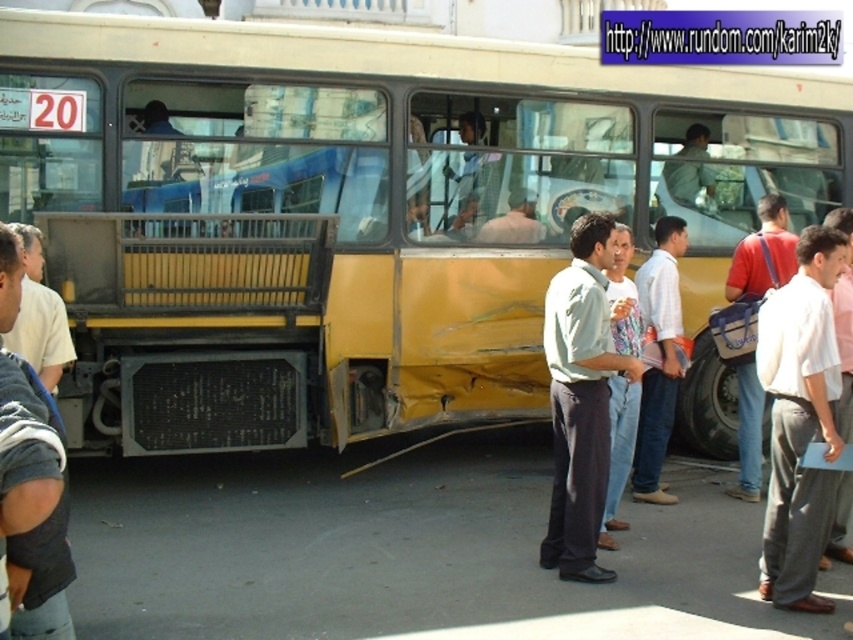
You are a pedestrian standing in front of the damaged bus. You see two people wearing a white cotton shirt at center and a light gray striped shirt at center. Which person is standing closer to you?

The white cotton shirt at center is positioned over light gray striped shirt at center, so the person wearing the white cotton shirt at center is closer to you.

From the picture: You are a pedestrian standing at the front of the bus. You want to walk to the damaged rear section of the bus. On your way, you see the white cotton shirt at center and the red fabric bag at center. Which object will you encounter first?

The white cotton shirt at center is much taller than the red fabric bag at center, so you will encounter the white cotton shirt at center first.

Looking at this image, you are a photographer standing near the damaged bus and want to take a photo of the light green fabric shirt at center and the white shirt at center. Which person should you focus on first if you want to capture the taller individual?

The white shirt at center is taller than the light green fabric shirt at center, so you should focus on the white shirt at center first to capture the taller individual.